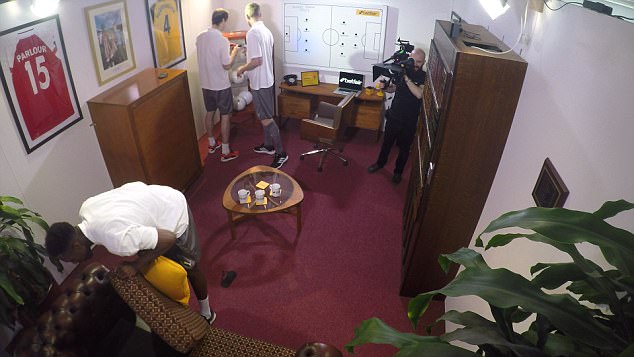
Where is `plant`? The image size is (634, 357). plant is located at coordinates (23, 265), (553, 221).